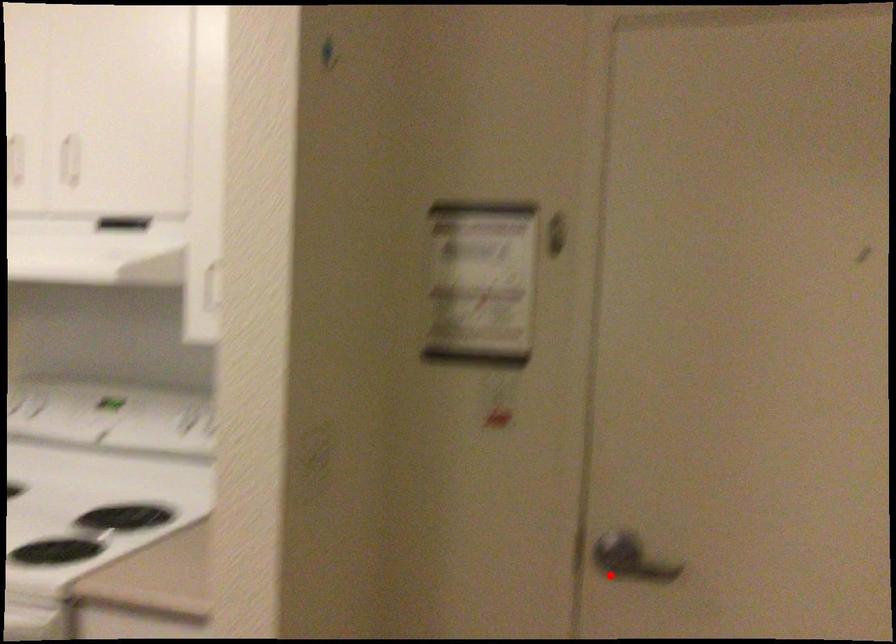
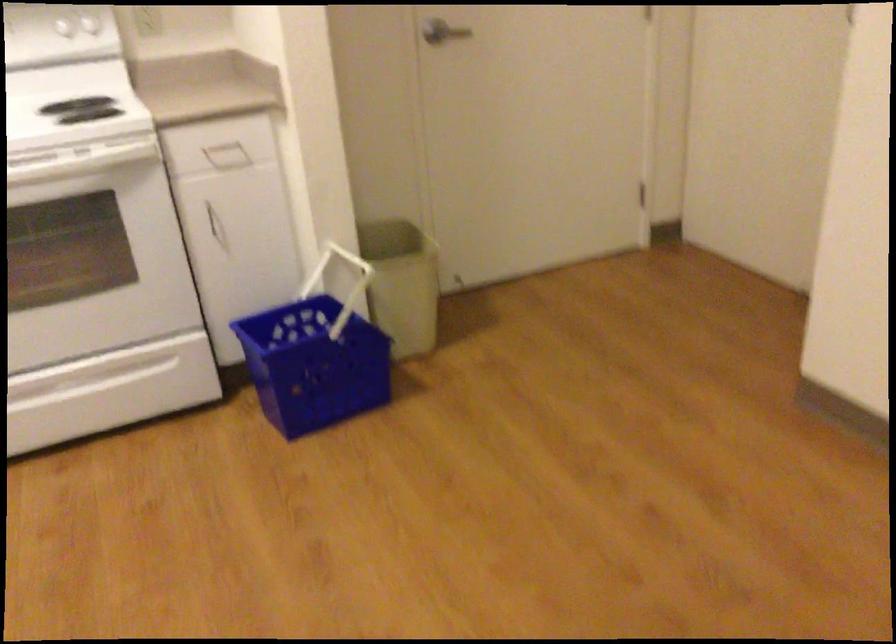
Where in the second image is the point corresponding to the highlighted location from the first image?

(437, 35)